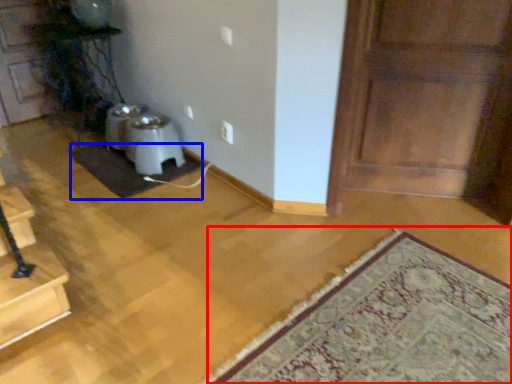
Question: Which point is further to the camera, mat (highlighted by a red box) or doormat (highlighted by a blue box)?

Choices:
 (A) mat
 (B) doormat

Answer: (B)